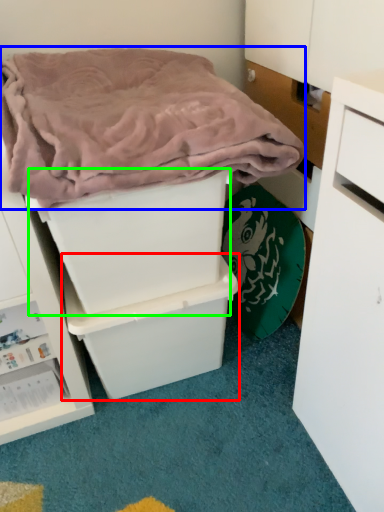
Question: Considering the real-world distances, which object is closest to storage box (highlighted by a red box)? blanket (highlighted by a blue box) or storage box (highlighted by a green box).

Choices:
 (A) blanket
 (B) storage box

Answer: (B)